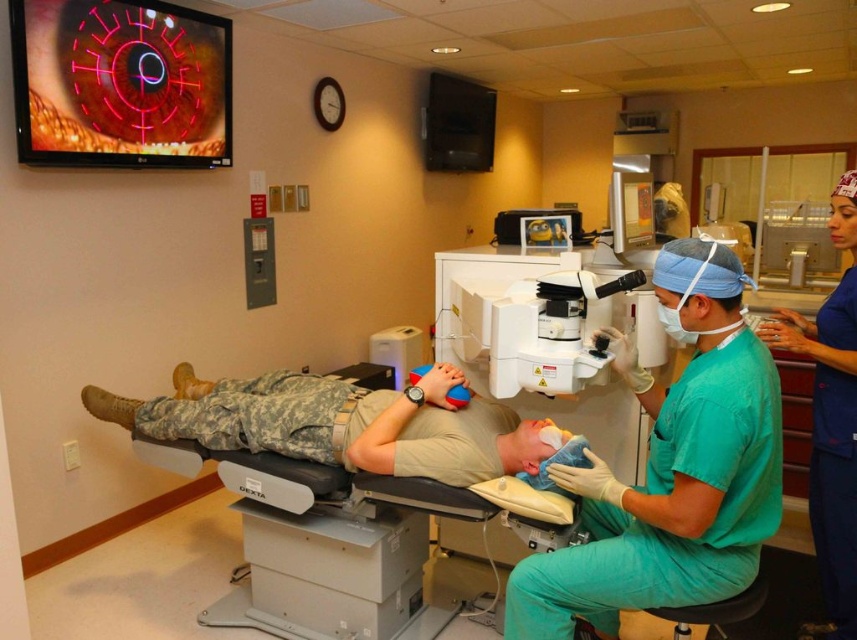
You are a medical student observing the procedure in the room. You need to describe the positions of the two individuals wearing green scrubs at center and camouflage fabric uniform at center. Which one is positioned lower?

The green scrubs at center is positioned lower than the camouflage fabric uniform at center because the green scrubs at center is described as being below the camouflage fabric uniform at center.

In the medical scene, there is a point labeled at coordinates (x=670, y=468). Which object from the list below is this point located on? The objects are the examination table labeled DEXTA, the medical professional in green scrubs at center, and the counter in the background.

The point at coordinates (x=670, y=468) is located on the medical professional in green scrubs at center.

Looking at this image, you are a medical student observing the procedure. You need to locate the blue scrubs at right and the blue rubber glove at lower center. Which object is located farther to the right in the scene?

The blue scrubs at right is positioned on the right side of blue rubber glove at lower center, so the blue scrubs at right is farther to the right.